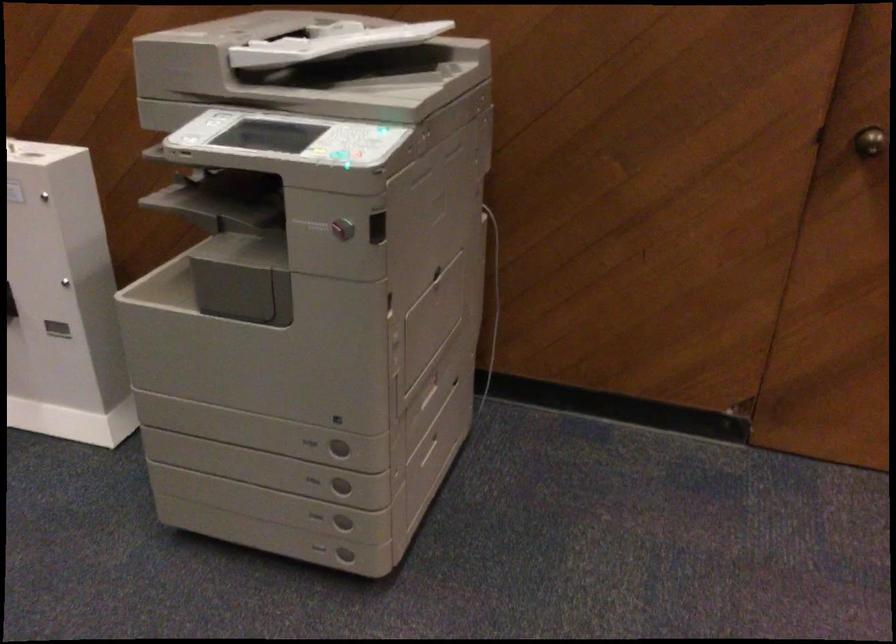
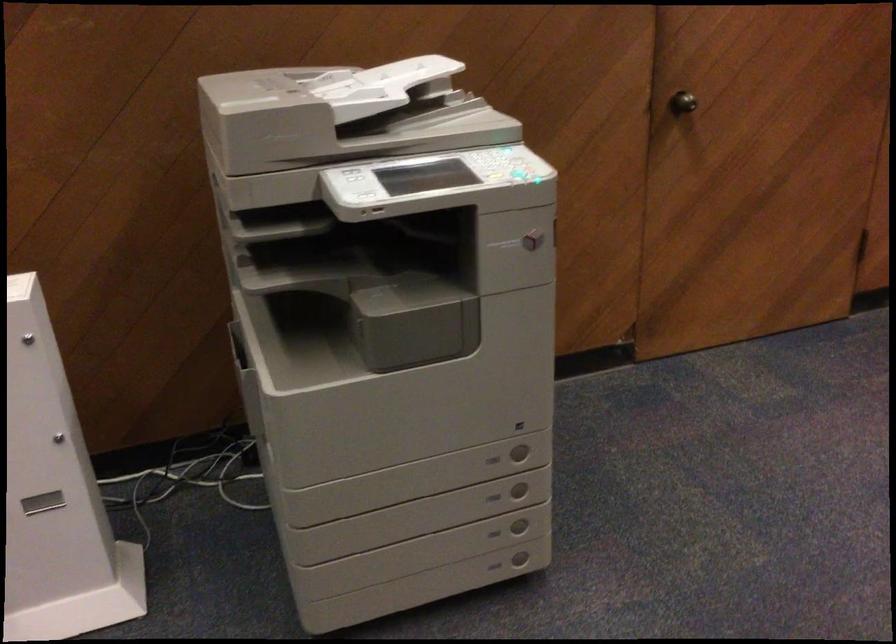
Locate, in the second image, the point that corresponds to point 340,451 in the first image.

(519, 451)